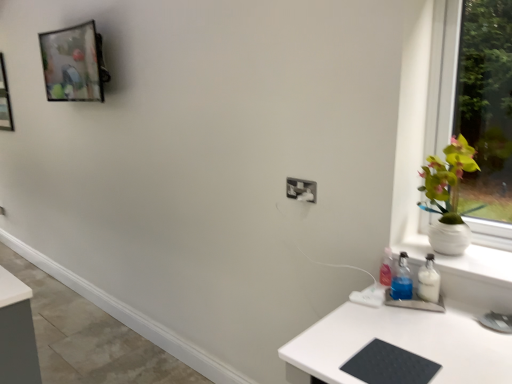
The height and width of the screenshot is (384, 512). Identify the location of vacant point above black rubberized mat at lower right (from a real-world perspective). (408, 345).